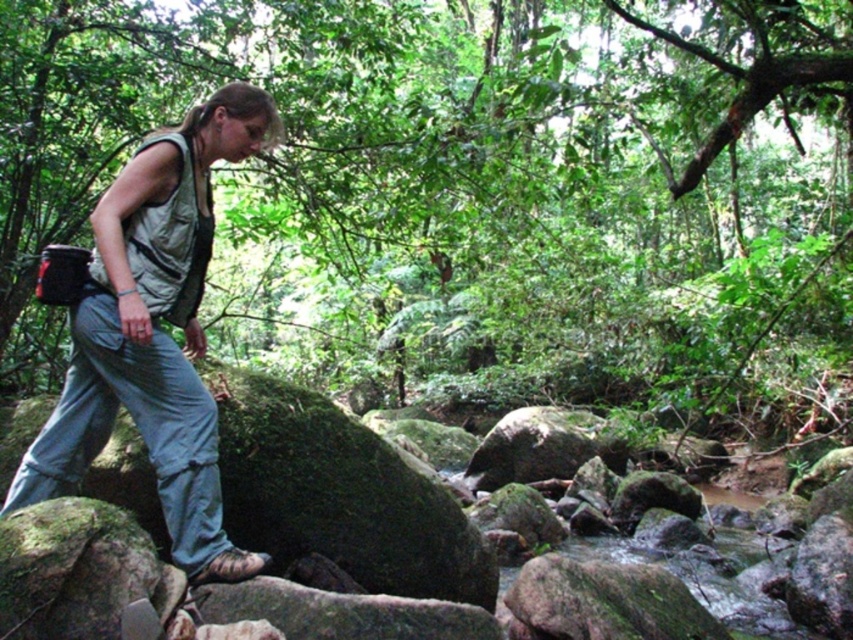
You are a hiker navigating the forest and see the green mossy rocks at center and the light gray fabric vest at left. Which object is positioned higher in the scene?

The green mossy rocks at center are positioned higher than the light gray fabric vest at left because they are located above it.

You are a hiker navigating a rocky stream in a forest. You notice a point marked at coordinates (460, 173). What is located at this point?

The green mossy rocks at center are located at point (460, 173).